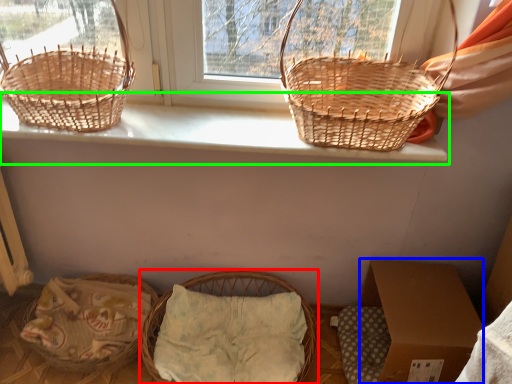
Question: Estimate the real-world distances between objects in this image. Which object is closer to picnic basket (highlighted by a red box), cardboard box (highlighted by a blue box) or window sill (highlighted by a green box)?

Choices:
 (A) cardboard box
 (B) window sill

Answer: (A)